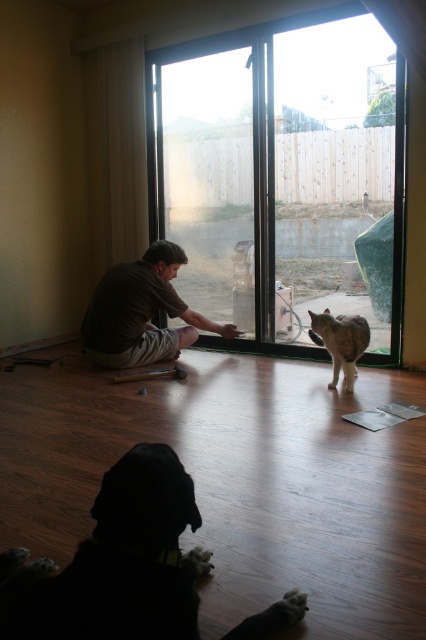
Question: Among these objects, which one is nearest to the camera?

Choices:
 (A) tabby fur cat at right
 (B) brown cotton shirt at center

Answer: (A)

Question: Can you confirm if brown cotton shirt at center is positioned to the right of tabby fur cat at right?

Choices:
 (A) no
 (B) yes

Answer: (A)

Question: Which object is positioned closest to the brown cotton shirt at center?

Choices:
 (A) silhouette fur dog at lower left
 (B) tabby fur cat at right
 (C) transparent glass door at center

Answer: (C)

Question: Which point is closer to the camera?

Choices:
 (A) silhouette fur dog at lower left
 (B) transparent glass door at center
 (C) tabby fur cat at right
 (D) brown cotton shirt at center

Answer: (A)

Question: Can you confirm if transparent glass door at center is positioned to the left of brown cotton shirt at center?

Choices:
 (A) yes
 (B) no

Answer: (B)

Question: Is silhouette fur dog at lower left to the left of tabby fur cat at right from the viewer's perspective?

Choices:
 (A) yes
 (B) no

Answer: (A)